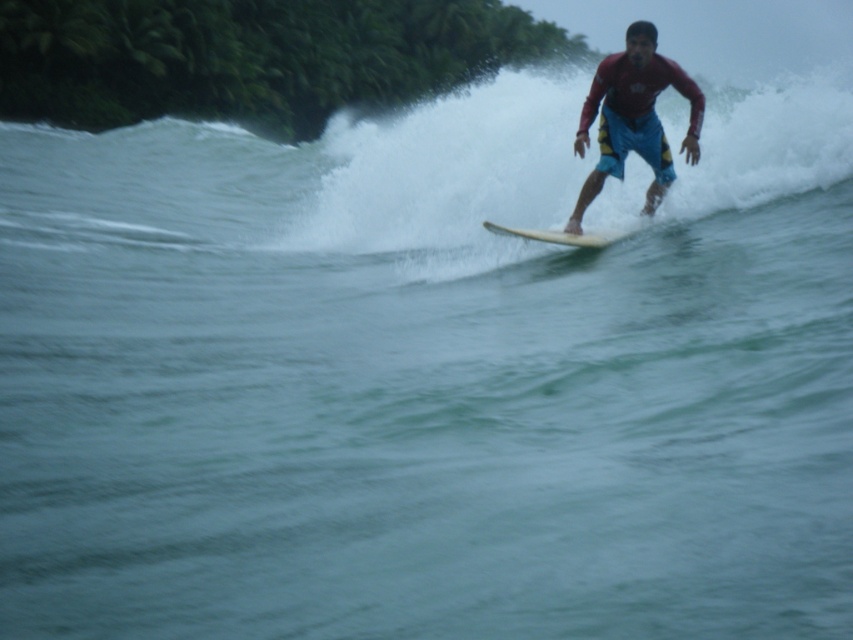
Does white foamy wave at upper center lie in front of white smooth surfboard at center?

Yes, white foamy wave at upper center is closer to the viewer.

Which is in front, point (786, 141) or point (635, 230)?

Positioned in front is point (635, 230).

Identify the location of white foamy wave at upper center. The height and width of the screenshot is (640, 853). (450, 168).

Who is shorter, white foamy wave at upper center or red matte surfboard at upper right?

With less height is red matte surfboard at upper right.

Who is more forward, (496, 145) or (607, 106)?

Point (607, 106) is in front.

Between point (720, 163) and point (611, 147), which one is positioned behind?

Point (720, 163)

Locate an element on the screen. white foamy wave at upper center is located at coordinates (450, 168).

Is point (573, 216) closer to camera compared to point (566, 241)?

No, (573, 216) is further to viewer.

Who is more forward, (x=628, y=109) or (x=554, y=240)?

Point (x=554, y=240) is in front.

Where is `red matte surfboard at upper right`? red matte surfboard at upper right is located at coordinates (633, 116).